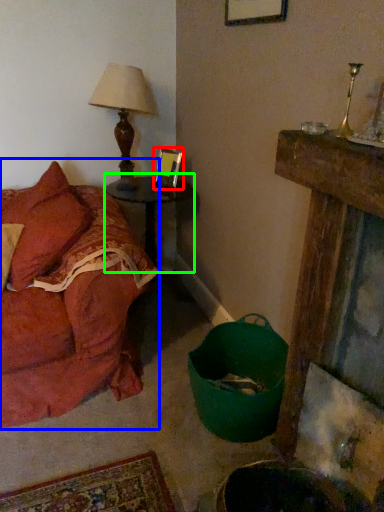
Question: Estimate the real-world distances between objects in this image. Which object is closer to picture frame (highlighted by a red box), studio couch (highlighted by a blue box) or table (highlighted by a green box)?

Choices:
 (A) studio couch
 (B) table

Answer: (B)